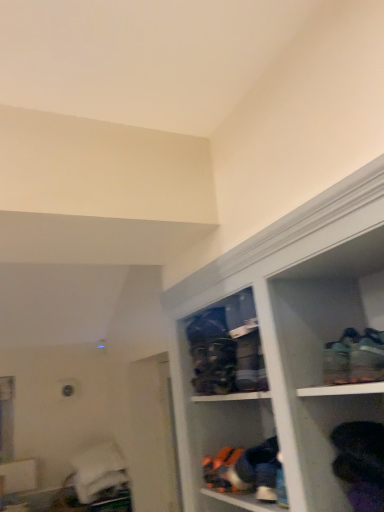
Question: Considering the positions of green fabric shoe at upper right and black fabric shoes at lower right in the image, is green fabric shoe at upper right taller or shorter than black fabric shoes at lower right?

Choices:
 (A) short
 (B) tall

Answer: (A)

Question: From a real-world perspective, is green fabric shoe at upper right above or below black fabric shoes at lower right?

Choices:
 (A) below
 (B) above

Answer: (B)

Question: Considering the real-world distances, which object is closest to the matte plastic shoe rack at center?

Choices:
 (A) green fabric shoe at upper right
 (B) black fabric shoes at lower right

Answer: (B)

Question: Estimate the real-world distances between objects in this image. Which object is closer to the matte plastic shoe rack at center?

Choices:
 (A) black fabric shoes at lower right
 (B) green fabric shoe at upper right

Answer: (A)